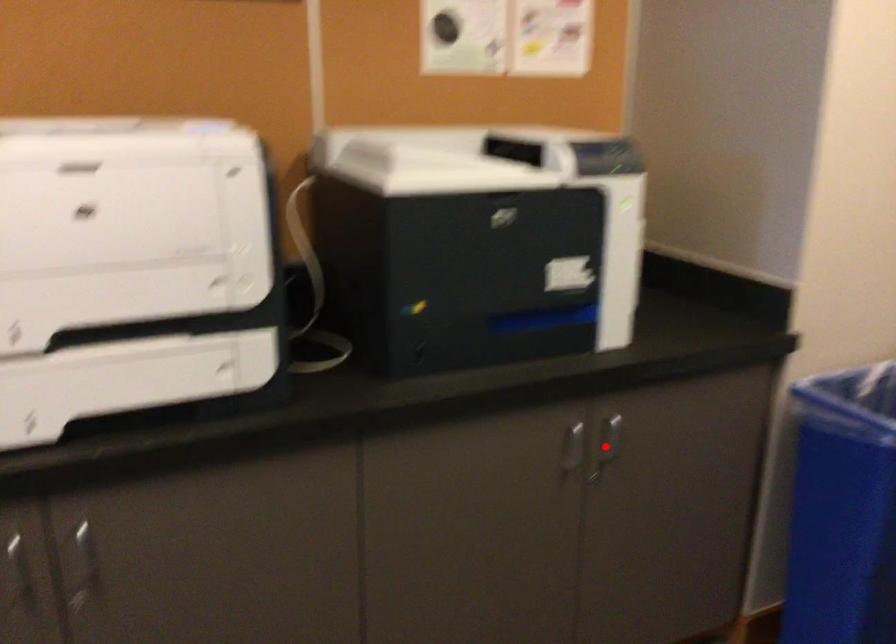
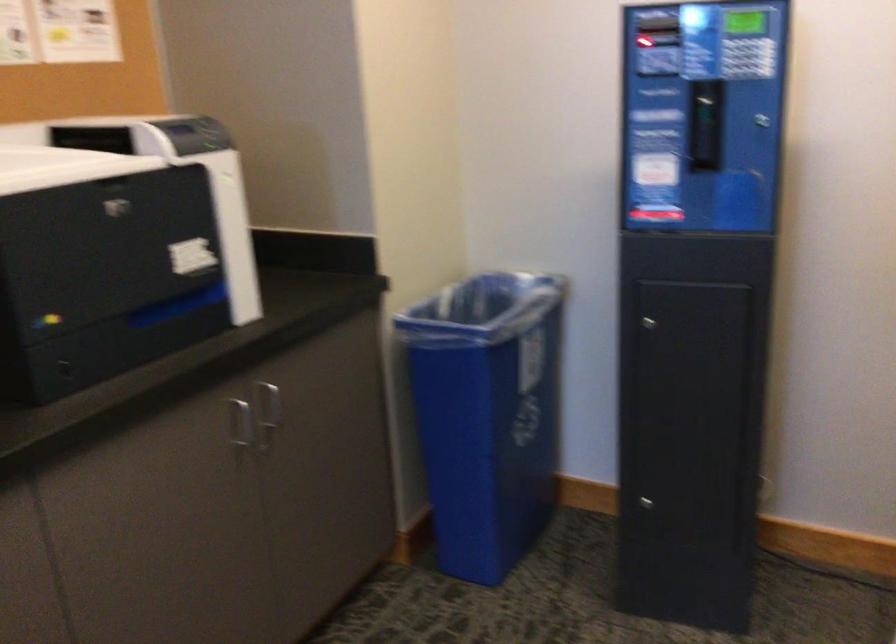
In the second image, find the point that corresponds to the highlighted location in the first image.

(270, 411)